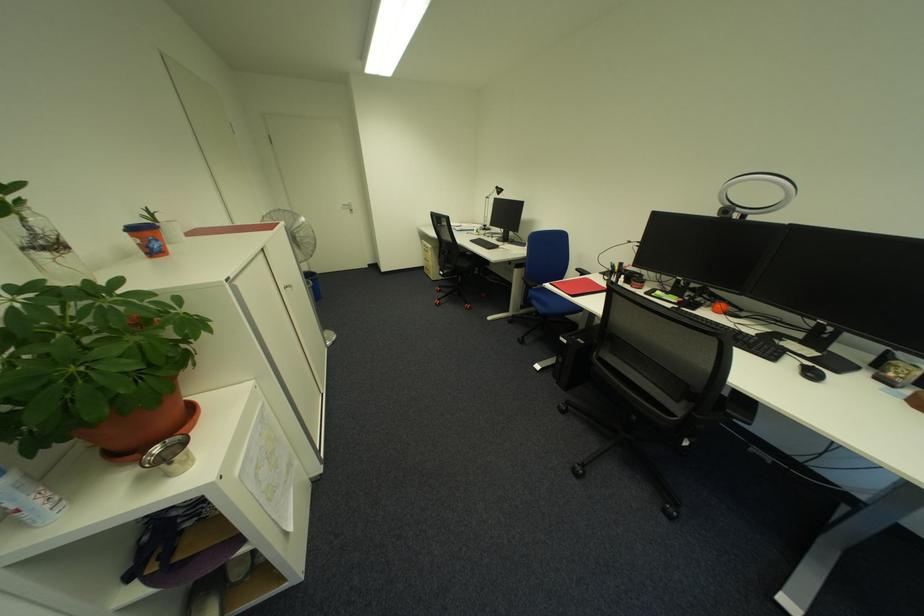
Locate an element on the screen. This screenshot has height=616, width=924. glass plant vase is located at coordinates (43, 246).